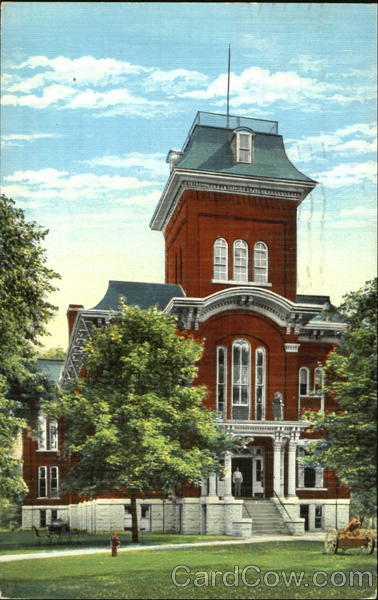
Locate an element on the screen. The width and height of the screenshot is (378, 600). chaiirs is located at coordinates (35, 532), (68, 536).